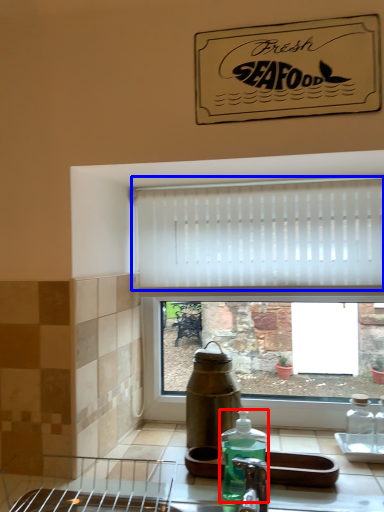
Question: Which of the following is the closest to the observer, bottle (highlighted by a red box) or curtain (highlighted by a blue box)?

Choices:
 (A) bottle
 (B) curtain

Answer: (A)